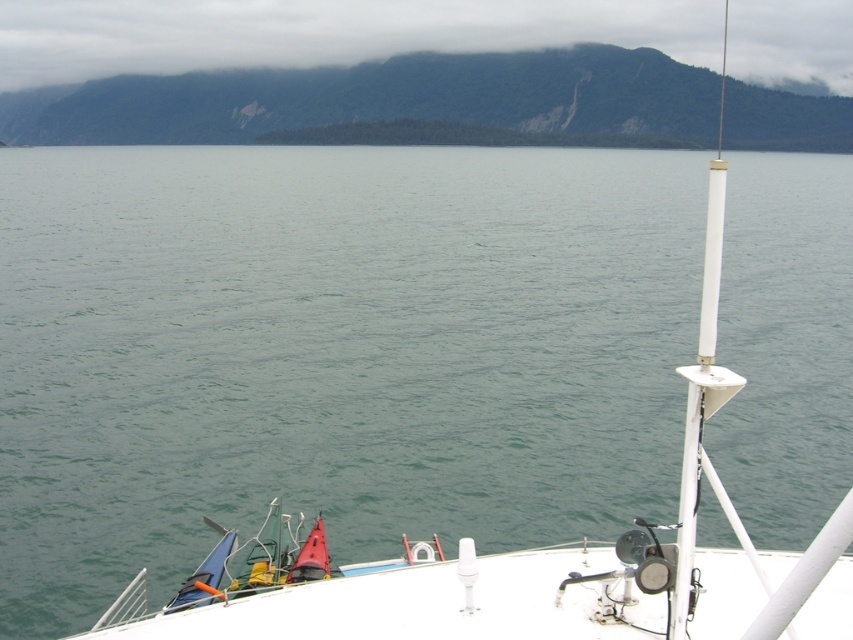
Who is higher up, green forested mountain at upper center or cloudy fog at upper center?

cloudy fog at upper center is above.

Can you confirm if green forested mountain at upper center is positioned below cloudy fog at upper center?

Indeed, green forested mountain at upper center is positioned under cloudy fog at upper center.

Identify the location of green forested mountain at upper center. (381, 99).